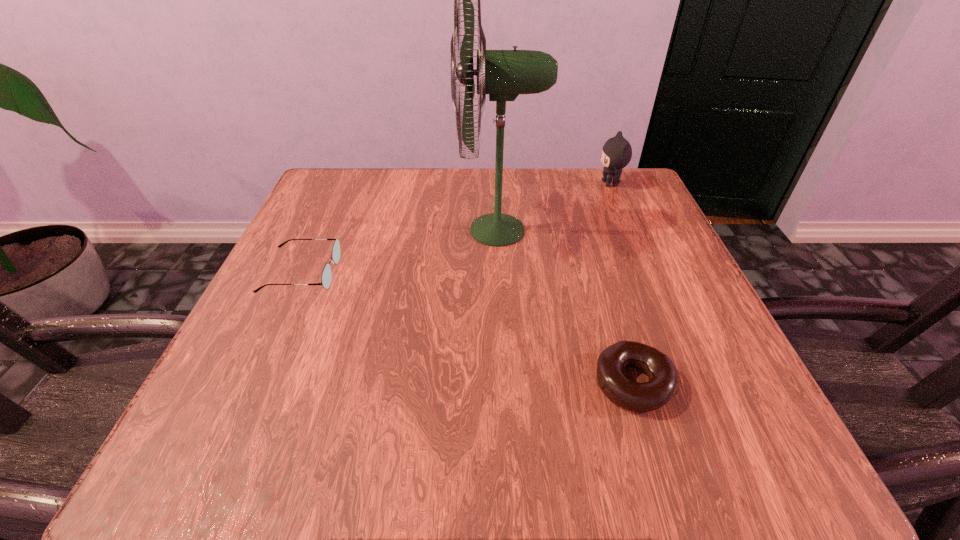
This screenshot has height=540, width=960. What are the coordinates of `the tallest object` in the screenshot? It's located at [x=503, y=74].

Locate an element on the screen. The image size is (960, 540). the second object from left to right is located at coordinates (503, 74).

I want to click on kitten, so click(x=616, y=153).

Where is `the rightmost object`? This screenshot has width=960, height=540. the rightmost object is located at coordinates (616, 153).

In order to click on spectacles in this screenshot , I will do `click(326, 274)`.

Identify the location of the nearest object. (663, 384).

Image resolution: width=960 pixels, height=540 pixels. In order to click on doughnut in this screenshot , I will do `click(663, 384)`.

Locate an element on the screen. free space located 0.250m on the front-facing side of the third object from right to left is located at coordinates coord(337,230).

Identify the location of free region located 0.070m on the front-facing side of the third object from right to left. (424, 230).

The width and height of the screenshot is (960, 540). I want to click on free spot located on the front-facing side of the third object from right to left, so click(299, 230).